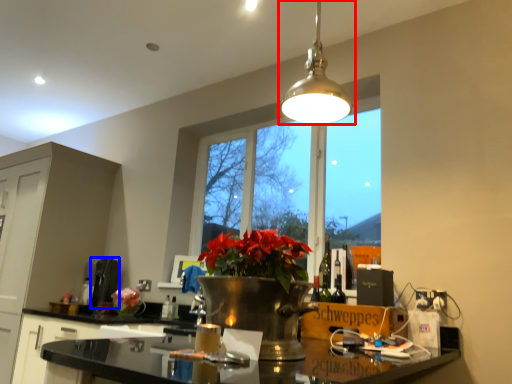
Question: Which object appears farthest to the camera in this image, lamp (highlighted by a red box) or appliance (highlighted by a blue box)?

Choices:
 (A) lamp
 (B) appliance

Answer: (B)